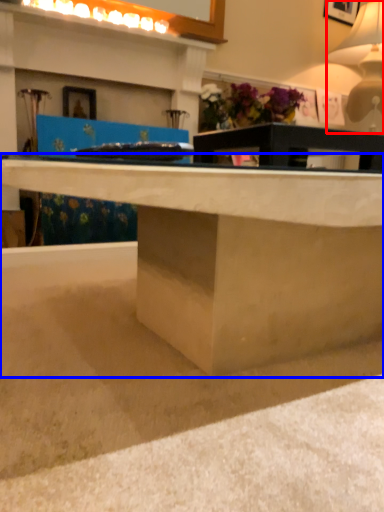
Question: Which of the following is the closest to the observer, table lamp (highlighted by a red box) or desk (highlighted by a blue box)?

Choices:
 (A) table lamp
 (B) desk

Answer: (B)